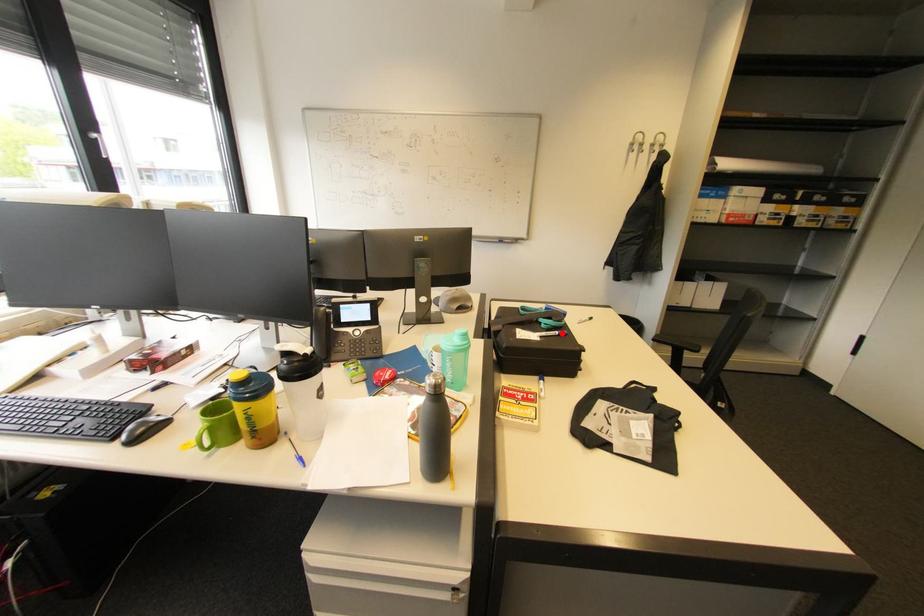
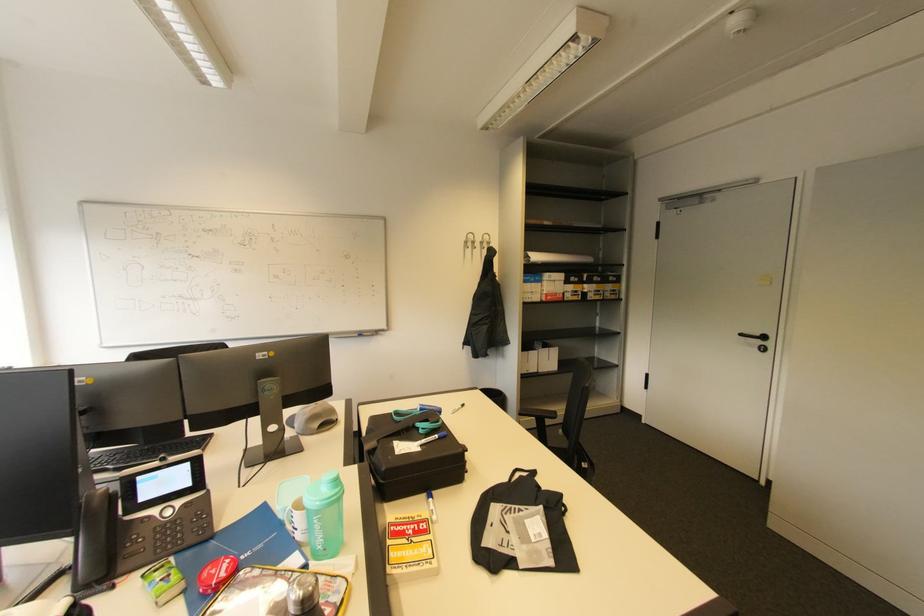
Locate, in the second image, the point that corresponds to the highlighted location in the first image.

(441, 437)